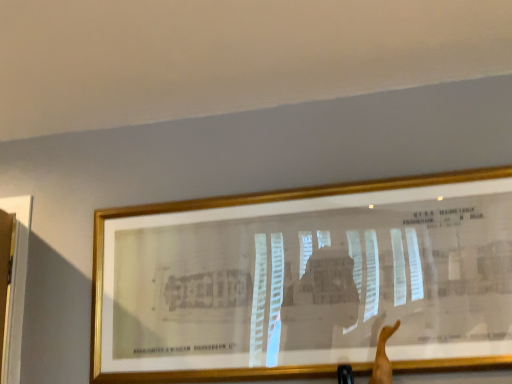
Question: Should I look upward or downward to see gold metallic picture frame at upper center?

Choices:
 (A) down
 (B) up

Answer: (A)

Question: Is skinny tan arm at lower right thinner than gold metallic picture frame at upper center?

Choices:
 (A) no
 (B) yes

Answer: (B)

Question: From the image's perspective, is skinny tan arm at lower right below gold metallic picture frame at upper center?

Choices:
 (A) no
 (B) yes

Answer: (B)

Question: Considering the relative positions of skinny tan arm at lower right and gold metallic picture frame at upper center in the image provided, is skinny tan arm at lower right to the right of gold metallic picture frame at upper center from the viewer's perspective?

Choices:
 (A) no
 (B) yes

Answer: (B)

Question: Is skinny tan arm at lower right closer to the viewer compared to gold metallic picture frame at upper center?

Choices:
 (A) yes
 (B) no

Answer: (A)

Question: Is skinny tan arm at lower right shorter than gold metallic picture frame at upper center?

Choices:
 (A) no
 (B) yes

Answer: (B)

Question: Is skinny tan arm at lower right bigger than gold metallic picture frame at upper center?

Choices:
 (A) no
 (B) yes

Answer: (A)

Question: From the image's perspective, is gold metallic picture frame at upper center below skinny tan arm at lower right?

Choices:
 (A) yes
 (B) no

Answer: (B)

Question: Is skinny tan arm at lower right a part of gold metallic picture frame at upper center?

Choices:
 (A) yes
 (B) no

Answer: (B)

Question: Is the surface of gold metallic picture frame at upper center in direct contact with skinny tan arm at lower right?

Choices:
 (A) yes
 (B) no

Answer: (B)

Question: Is gold metallic picture frame at upper center thinner than skinny tan arm at lower right?

Choices:
 (A) no
 (B) yes

Answer: (A)

Question: Is the position of gold metallic picture frame at upper center less distant than that of skinny tan arm at lower right?

Choices:
 (A) yes
 (B) no

Answer: (B)

Question: Is gold metallic picture frame at upper center at the left side of skinny tan arm at lower right?

Choices:
 (A) no
 (B) yes

Answer: (B)

Question: In terms of height, does skinny tan arm at lower right look taller or shorter compared to gold metallic picture frame at upper center?

Choices:
 (A) tall
 (B) short

Answer: (B)